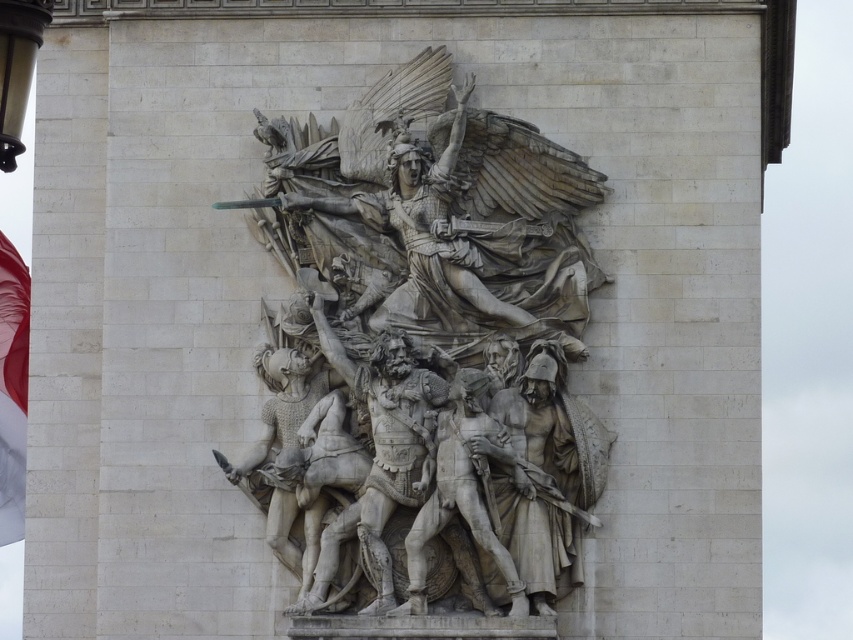
Can you confirm if white stone sculpture at center is thinner than red fabric flag at left?

Incorrect, white stone sculpture at center's width is not less than red fabric flag at left's.

Which of these two, white stone sculpture at center or red fabric flag at left, stands shorter?

With less height is red fabric flag at left.

Consider the image. Who is more distant from viewer, [370,188] or [22,372]?

Positioned behind is point [22,372].

This screenshot has width=853, height=640. What are the coordinates of `white stone sculpture at center` in the screenshot? It's located at (424, 356).